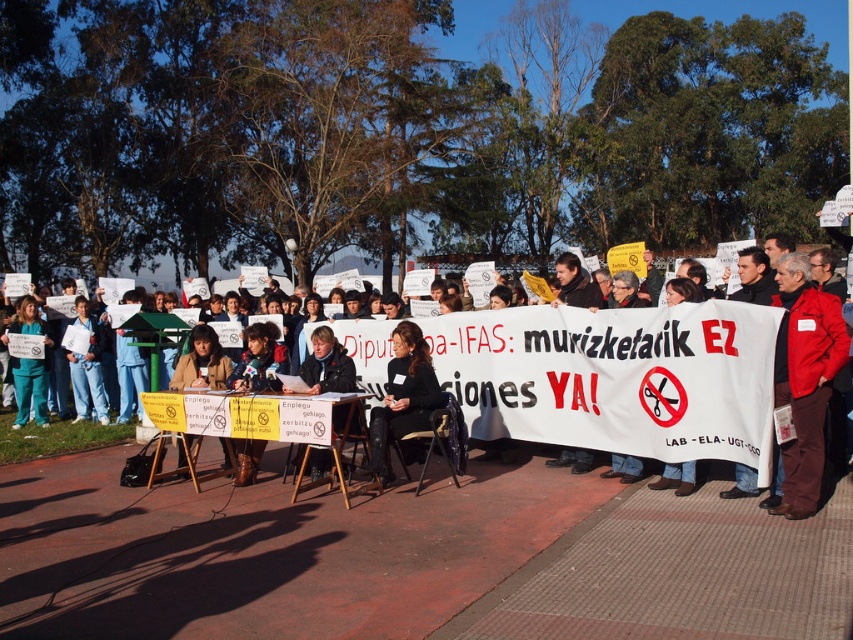
Measure the distance between green scrubs at center and blue jeans at left.

green scrubs at center is 24.35 inches from blue jeans at left.

In the scene shown: Does green scrubs at center appear over blue jeans at left?

Actually, green scrubs at center is below blue jeans at left.

Does point (36, 317) lie behind point (80, 417)?

No, it is not.

Locate an element on the screen. green scrubs at center is located at coordinates (28, 364).

Does red matte jacket at right appear under green scrubs at center?

No.

Is red matte jacket at right closer to camera compared to green scrubs at center?

Yes, red matte jacket at right is closer to the viewer.

Is point (799, 381) positioned before point (18, 400)?

Yes, it is in front of point (18, 400).

You are a GUI agent. You are given a task and a screenshot of the screen. Output one action in this format:
    pyautogui.click(x=<x>, y=<y>)
    Task: Click on the red matte jacket at right
    Image resolution: width=853 pixels, height=640 pixels.
    Given the screenshot: What is the action you would take?
    pyautogui.click(x=804, y=380)

Measure the distance from red matte jacket at right to matte black jacket at center.

A distance of 4.09 meters exists between red matte jacket at right and matte black jacket at center.

Identify the location of red matte jacket at right. This screenshot has height=640, width=853. (804, 380).